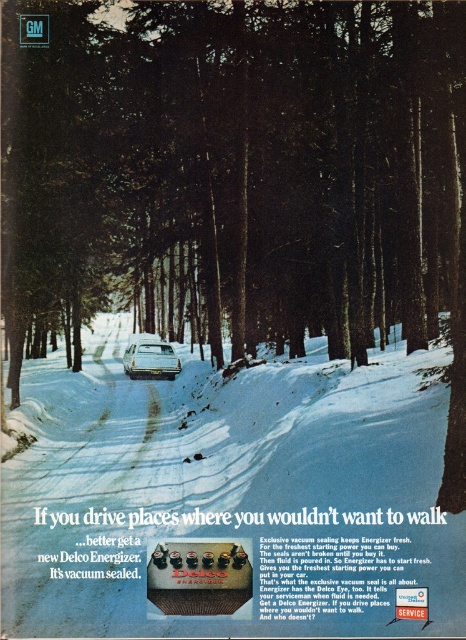
Question: Is white powdery snow at center wider than shiny silver car at center?

Choices:
 (A) no
 (B) yes

Answer: (B)

Question: In this image, where is white powdery snow at center located relative to shiny silver car at center?

Choices:
 (A) left
 (B) right

Answer: (B)

Question: Which of the following is the farthest from the observer?

Choices:
 (A) (128, 362)
 (B) (342, 518)

Answer: (A)

Question: Which point is farther to the camera?

Choices:
 (A) (165, 348)
 (B) (39, 476)

Answer: (A)

Question: Can you confirm if white powdery snow at center is bigger than shiny silver car at center?

Choices:
 (A) no
 (B) yes

Answer: (B)

Question: Which point is farther to the camera?

Choices:
 (A) (158, 352)
 (B) (75, 580)

Answer: (A)